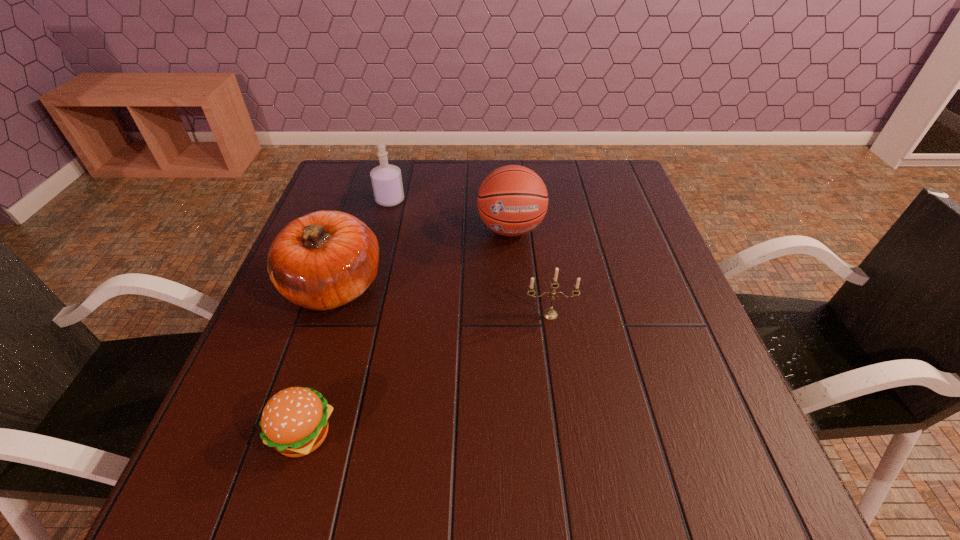
This screenshot has width=960, height=540. I want to click on free space located 0.270m on the back of the nearest object, so click(346, 296).

Locate an element on the screen. Image resolution: width=960 pixels, height=540 pixels. object located at the far edge is located at coordinates (386, 179).

Image resolution: width=960 pixels, height=540 pixels. In order to click on object located in the near edge section of the desktop in this screenshot , I will do `click(294, 422)`.

This screenshot has height=540, width=960. In order to click on pumpkin located at the left edge in this screenshot , I will do `click(326, 259)`.

Image resolution: width=960 pixels, height=540 pixels. I want to click on perfume situated at the left edge, so click(x=386, y=179).

Where is `hamburger located in the left edge section of the desktop`? hamburger located in the left edge section of the desktop is located at coordinates (294, 422).

Identify the location of object positioned at the far left corner. The image size is (960, 540). (386, 179).

This screenshot has width=960, height=540. Find the location of `object located at the near left corner`. object located at the near left corner is located at coordinates (294, 422).

Where is `free space at the far edge of the desktop`? free space at the far edge of the desktop is located at coordinates (561, 163).

Image resolution: width=960 pixels, height=540 pixels. In order to click on vacant area at the near edge in this screenshot , I will do `click(560, 486)`.